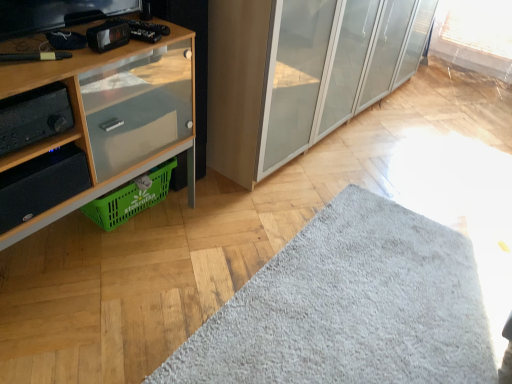
Find the location of a particular element. This screenshot has width=512, height=384. empty space that is in between gray fluffy mat at lower center and green plastic basket at lower left is located at coordinates (192, 251).